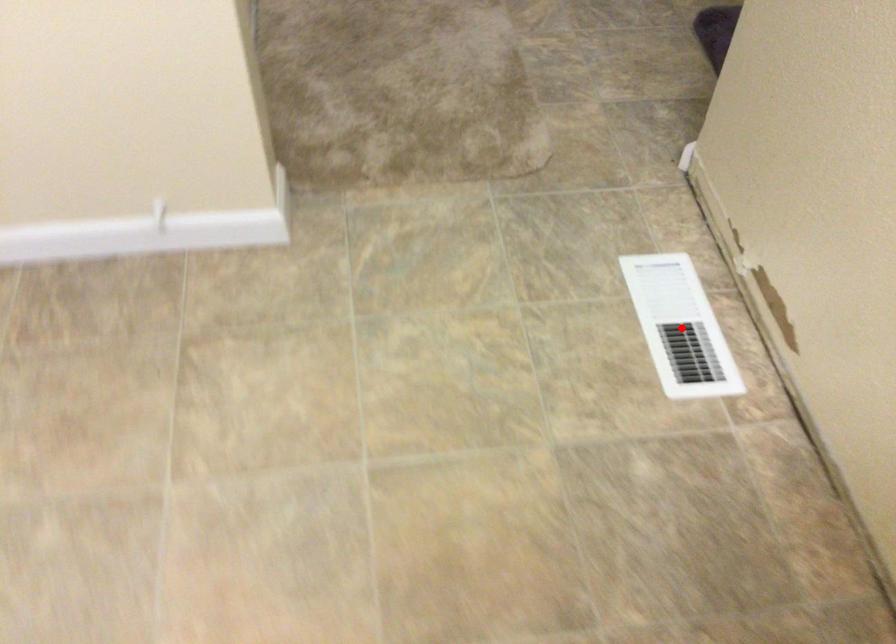
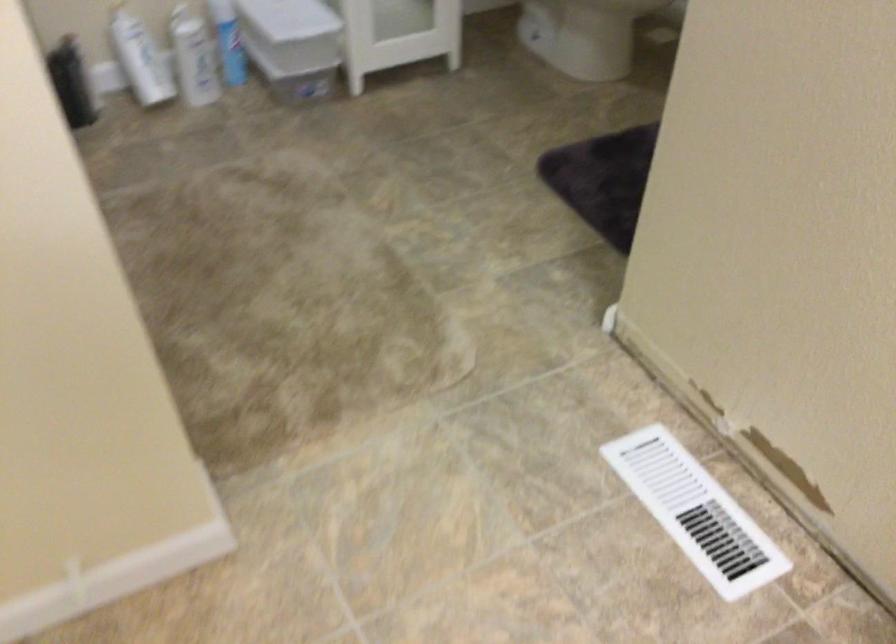
The point at the highlighted location is marked in the first image. Where is the corresponding point in the second image?

(695, 512)